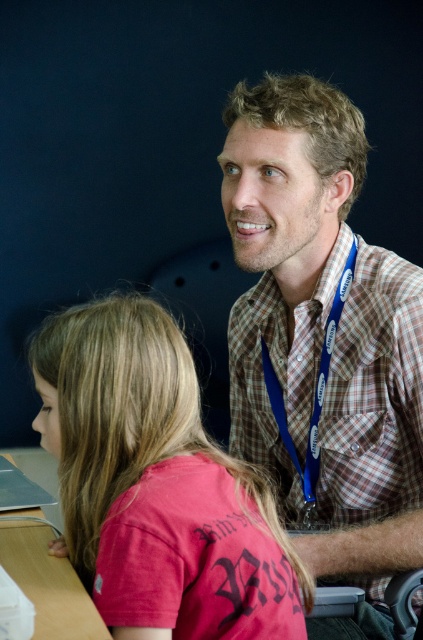
From the picture: You are a photographer standing behind the man with the Samsung lanyard. You need to take a photo of the matte pink shirt at lower left and the wooden table at lower left. Which object should you adjust your camera angle to focus on first if you want to capture both in the same frame without moving your position?

The matte pink shirt at lower left is taller than the wooden table at lower left, so you should focus on the taller matte pink shirt at lower left first to ensure it fits within the frame, then adjust to include the shorter wooden table at lower left.

You are a photographer standing at the camera position. You want to take a photo of the point at coordinates point [65,589]. The focus distance of your camera is set to 40 inches. Will the point be in focus?

The point at coordinates point [65,589] is 39.30 inches away from the camera. Since the focus distance is set to 40 inches, the point will be slightly out of focus.